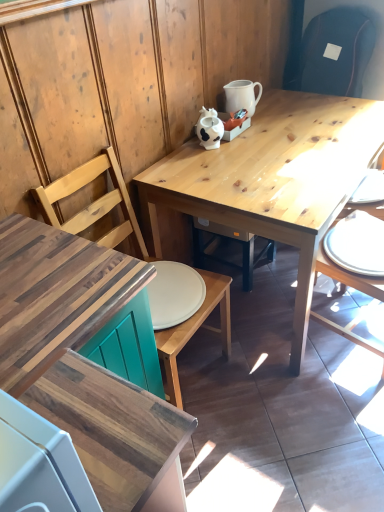
Identify the location of vacant location below wooden chair at right, which is the 2th chair in left-to-right order (from a real-world perspective). (356, 326).